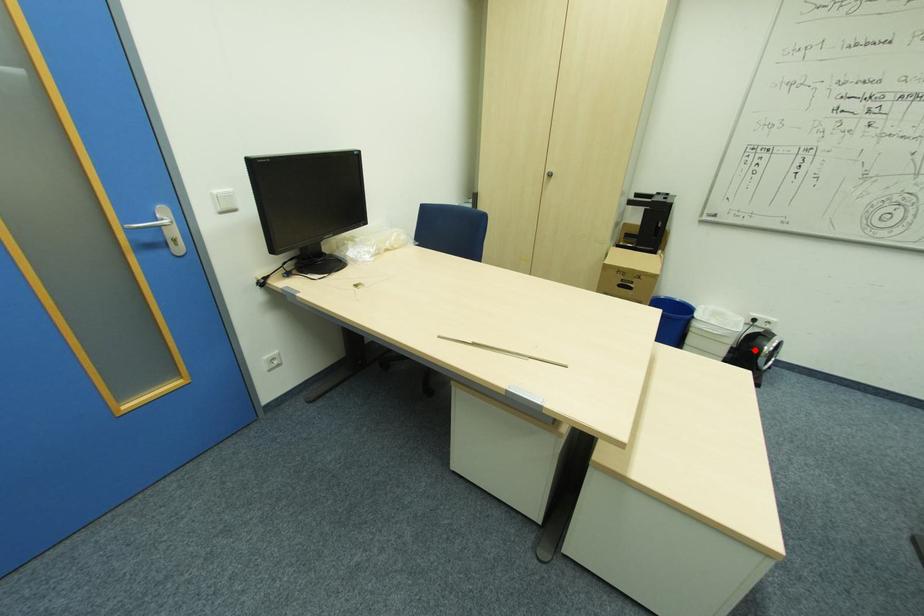
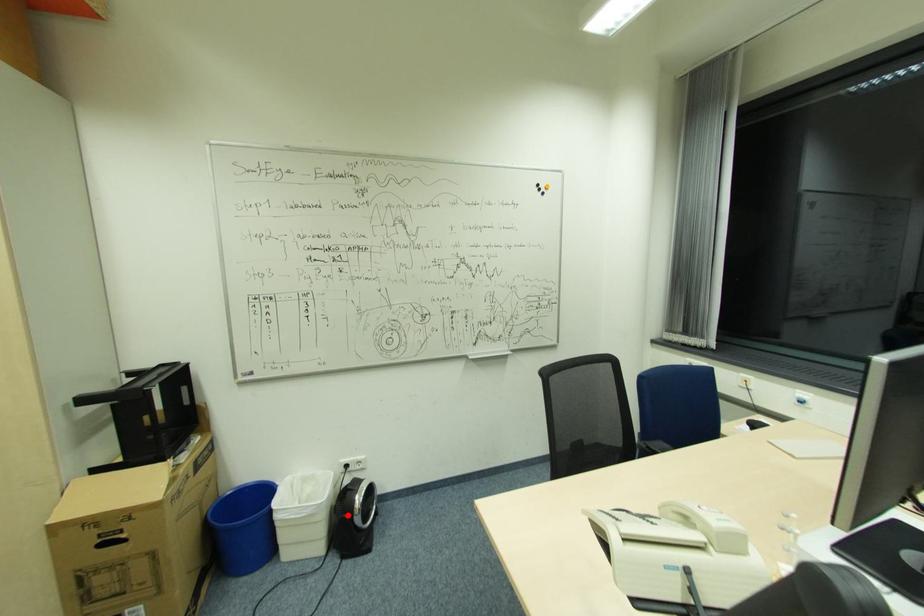
I am providing you with two images of the same scene from different viewpoints. A red point is marked on the first image and another point is marked on the second image. Is the marked point in image1 the same physical position as the marked point in image2?

Yes